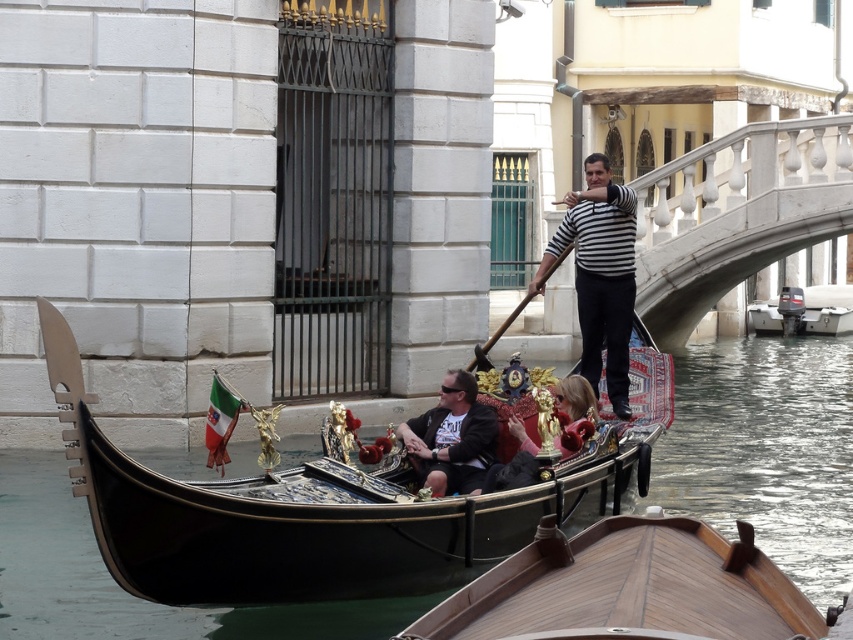
Is wooden polished boat at center positioned behind white plastic motorboat at right?

No.

Does point (787, 621) come behind point (817, 330)?

No, it is not.

Where is `wooden polished boat at center`? Image resolution: width=853 pixels, height=640 pixels. wooden polished boat at center is located at coordinates click(627, 588).

Does black polished wood gondola at center appear on the right side of striped fabric man at center?

No, black polished wood gondola at center is not to the right of striped fabric man at center.

Is black polished wood gondola at center to the left of striped fabric man at center from the viewer's perspective?

Yes, black polished wood gondola at center is to the left of striped fabric man at center.

Between point (300, 536) and point (616, 291), which one is positioned behind?

The point (616, 291) is behind.

Where is `black polished wood gondola at center`? This screenshot has width=853, height=640. black polished wood gondola at center is located at coordinates (296, 515).

Between black polished wood gondola at center and wooden polished boat at center, which one appears on the right side from the viewer's perspective?

wooden polished boat at center is more to the right.

Who is more forward, (415,532) or (676,602)?

Positioned in front is point (676,602).

Locate an element on the screen. black polished wood gondola at center is located at coordinates (296, 515).